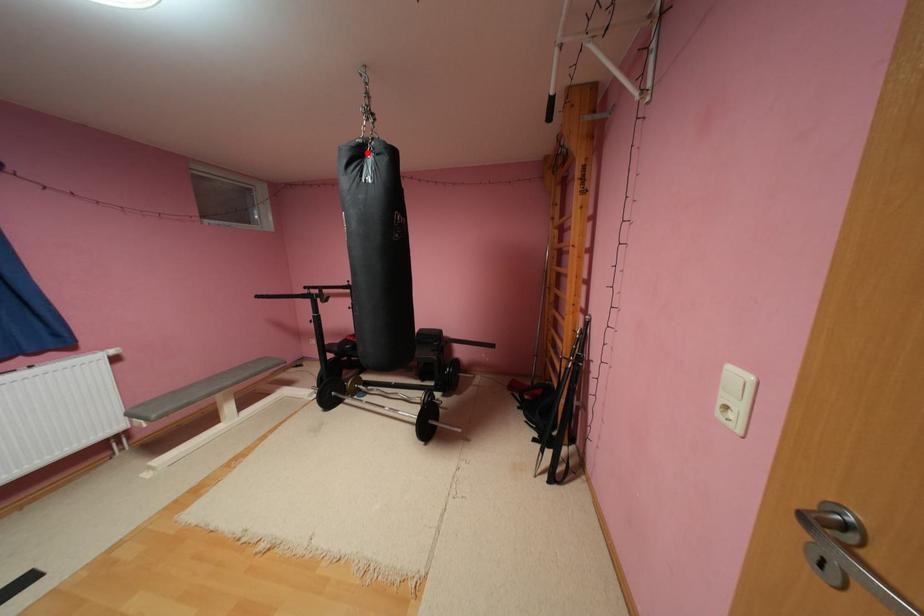
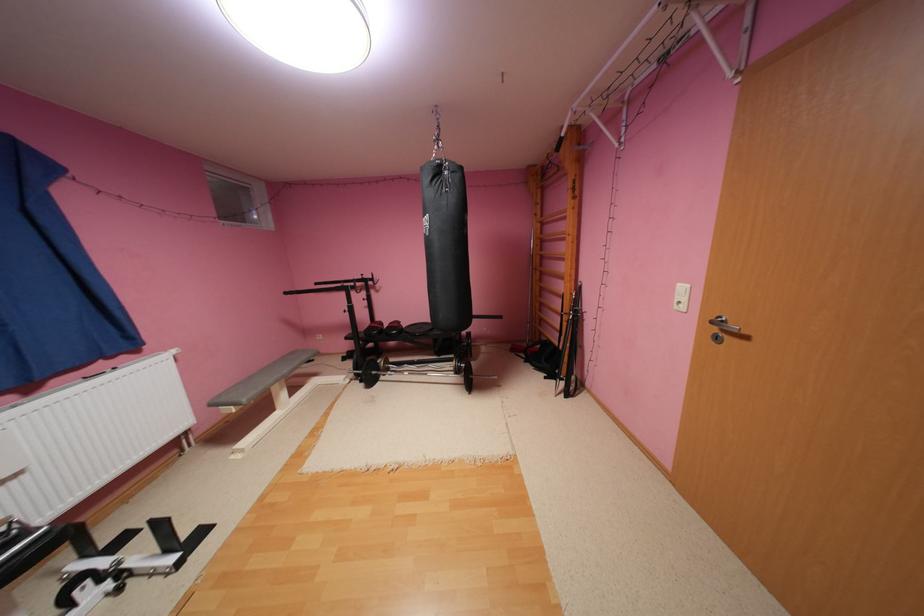
Find the pixel in the second image that matches the highlighted location in the first image.

(446, 171)